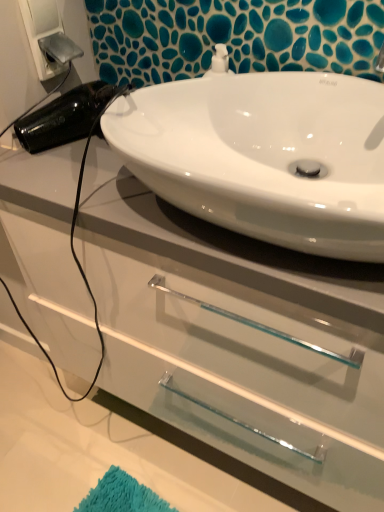
Question: Can you confirm if white glossy cabinet at center is thinner than white plastic electric outlet at upper left?

Choices:
 (A) no
 (B) yes

Answer: (A)

Question: Is white glossy cabinet at center further to camera compared to white plastic electric outlet at upper left?

Choices:
 (A) yes
 (B) no

Answer: (B)

Question: Is white glossy cabinet at center facing towards white plastic electric outlet at upper left?

Choices:
 (A) no
 (B) yes

Answer: (A)

Question: Can you confirm if white glossy cabinet at center is smaller than white plastic electric outlet at upper left?

Choices:
 (A) no
 (B) yes

Answer: (A)

Question: Is the position of white glossy cabinet at center less distant than that of white plastic electric outlet at upper left?

Choices:
 (A) yes
 (B) no

Answer: (A)

Question: In terms of width, does white plastic electric outlet at upper left look wider or thinner when compared to white glossy sink at upper center?

Choices:
 (A) wide
 (B) thin

Answer: (B)

Question: From a real-world perspective, relative to white glossy sink at upper center, is white plastic electric outlet at upper left vertically above or below?

Choices:
 (A) above
 (B) below

Answer: (A)

Question: Visually, is white plastic electric outlet at upper left positioned to the left or to the right of white glossy sink at upper center?

Choices:
 (A) left
 (B) right

Answer: (A)

Question: From the image's perspective, is white plastic electric outlet at upper left positioned above or below white glossy sink at upper center?

Choices:
 (A) above
 (B) below

Answer: (A)

Question: Is white plastic electric outlet at upper left taller or shorter than white glossy cabinet at center?

Choices:
 (A) short
 (B) tall

Answer: (A)

Question: Relative to white glossy cabinet at center, is white plastic electric outlet at upper left in front or behind?

Choices:
 (A) front
 (B) behind

Answer: (B)

Question: From the image's perspective, is white plastic electric outlet at upper left positioned above or below white glossy cabinet at center?

Choices:
 (A) above
 (B) below

Answer: (A)

Question: Is white plastic electric outlet at upper left bigger or smaller than white glossy cabinet at center?

Choices:
 (A) small
 (B) big

Answer: (A)

Question: In terms of height, does white glossy cabinet at center look taller or shorter compared to white plastic electric outlet at upper left?

Choices:
 (A) short
 (B) tall

Answer: (B)

Question: Is white glossy cabinet at center to the left or to the right of white plastic electric outlet at upper left in the image?

Choices:
 (A) right
 (B) left

Answer: (A)